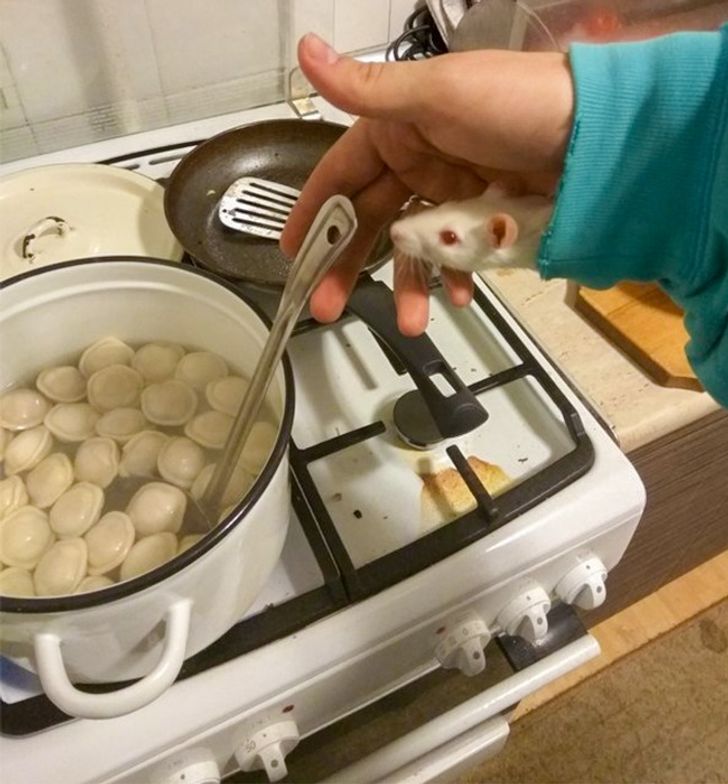
Where is `burner`? Image resolution: width=728 pixels, height=784 pixels. burner is located at coordinates (423, 416).